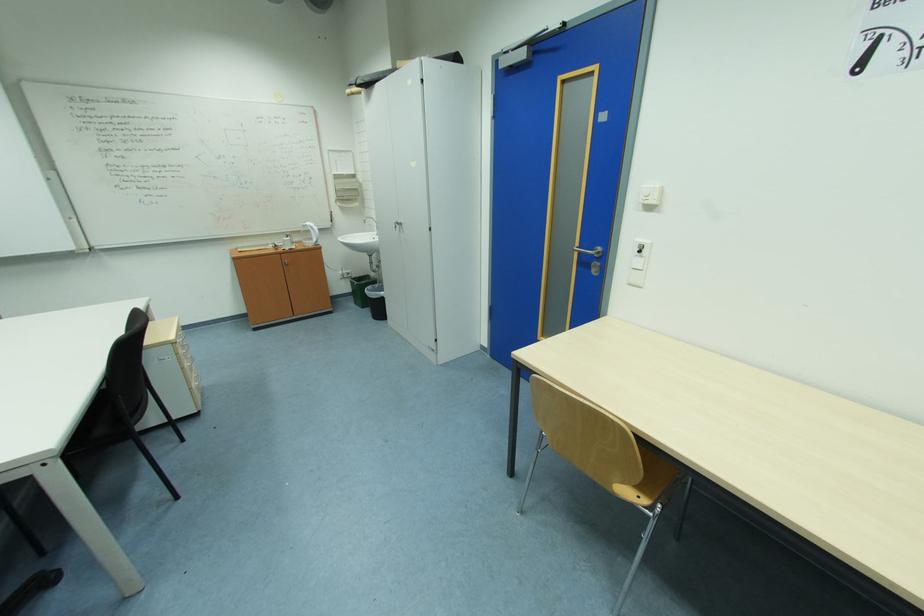
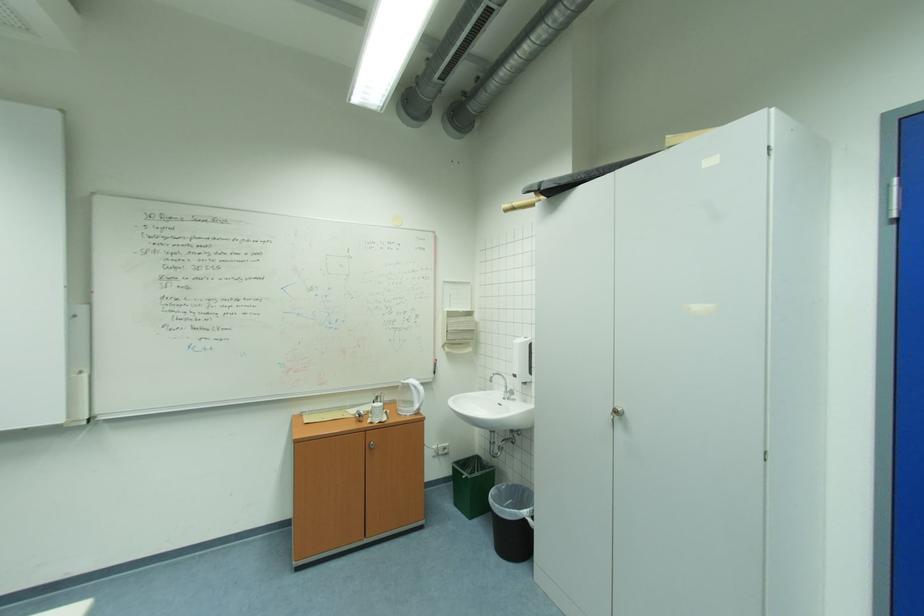
Locate, in the second image, the point that corresponds to (315,245) in the first image.

(415, 411)